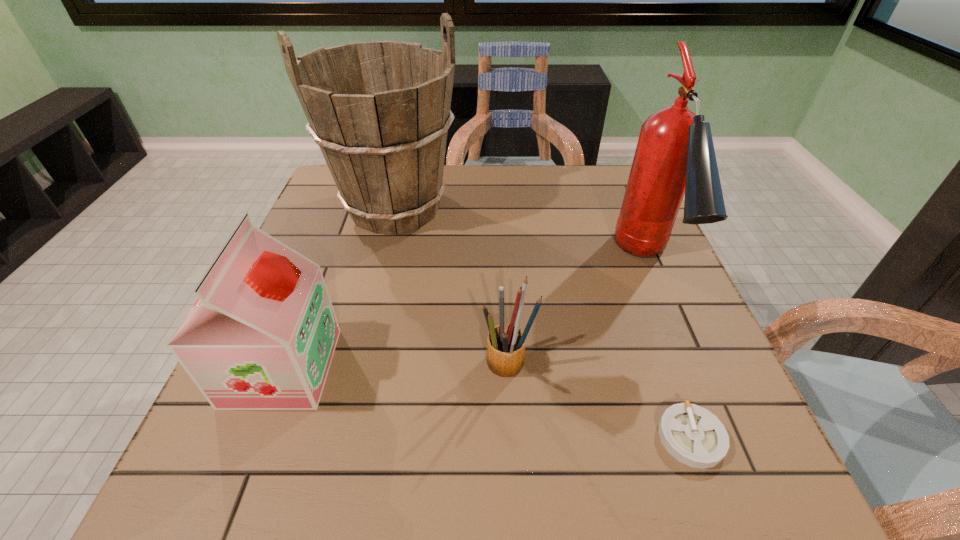
Identify the location of vacant area that lies between the third tallest object and the pencil box. The height and width of the screenshot is (540, 960). (396, 367).

Where is `free space between the fire extinguisher and the bucket`? free space between the fire extinguisher and the bucket is located at coordinates (521, 235).

The width and height of the screenshot is (960, 540). In order to click on vacant space that is in between the pencil box and the soya milk in this screenshot , I will do `click(396, 367)`.

This screenshot has width=960, height=540. Identify the location of free spot between the bucket and the third tallest object. (339, 287).

Where is `blank region between the bucket and the third object from right to left`? blank region between the bucket and the third object from right to left is located at coordinates (452, 287).

The height and width of the screenshot is (540, 960). Identify the location of vacant space in between the soya milk and the bucket. (339, 287).

Identify the location of the fourth closest object relative to the ashtray. (261, 335).

Locate which object is the second closest to the fire extinguisher. Please provide its 2D coordinates. Your answer should be formatted as a tuple, i.e. [(x, y)], where the tuple contains the x and y coordinates of a point satisfying the conditions above.

[(506, 343)]

Identify the location of blank space that satisfies the following two spatial constraints: 1. at the nozzle end of the fire extinguisher; 2. with the cap open on the third tallest object. (691, 367).

You are a GUI agent. You are given a task and a screenshot of the screen. Output one action in this format:
    pyautogui.click(x=<x>, y=<y>)
    Task: Click on the free location that satisfies the following two spatial constraints: 1. at the nozzle end of the fire extinguisher; 2. with the cap open on the soya milk
    This screenshot has height=540, width=960.
    Given the screenshot: What is the action you would take?
    pyautogui.click(x=691, y=367)